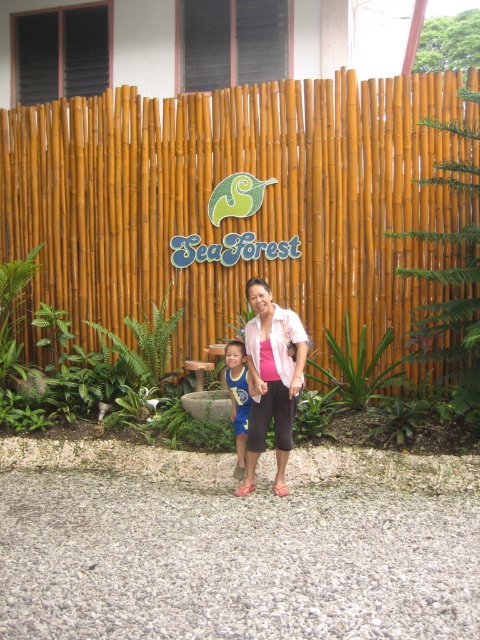
How distant is pink matte shirt at center from blue jersey at center?

pink matte shirt at center is 14.04 inches away from blue jersey at center.

Does pink matte shirt at center have a lesser height compared to blue jersey at center?

No.

The image size is (480, 640). Find the location of `pink matte shirt at center`. pink matte shirt at center is located at coordinates (272, 380).

Does point (443, 257) lie in front of point (277, 365)?

No, it is behind (277, 365).

Identify the location of bamboo fence at center. (233, 218).

Is bamboo fence at center behind blue jersey at center?

That is True.

Is bamboo fence at center closer to camera compared to blue jersey at center?

No, it is behind blue jersey at center.

Which is in front, point (34, 188) or point (240, 419)?

Point (240, 419) is more forward.

This screenshot has height=640, width=480. In order to click on bamboo fence at center in this screenshot , I will do tap(233, 218).